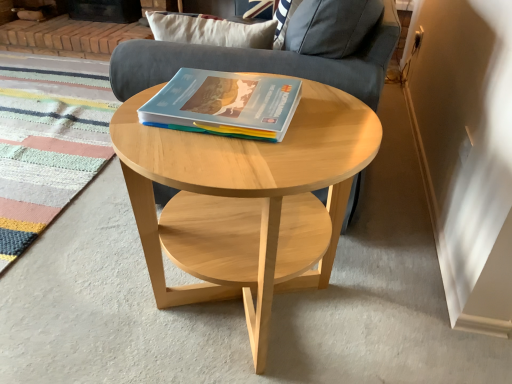
Locate an element on the screen. The image size is (512, 384). free space between gray fabric armchair at center and natural wood coffee table at center is located at coordinates (145, 278).